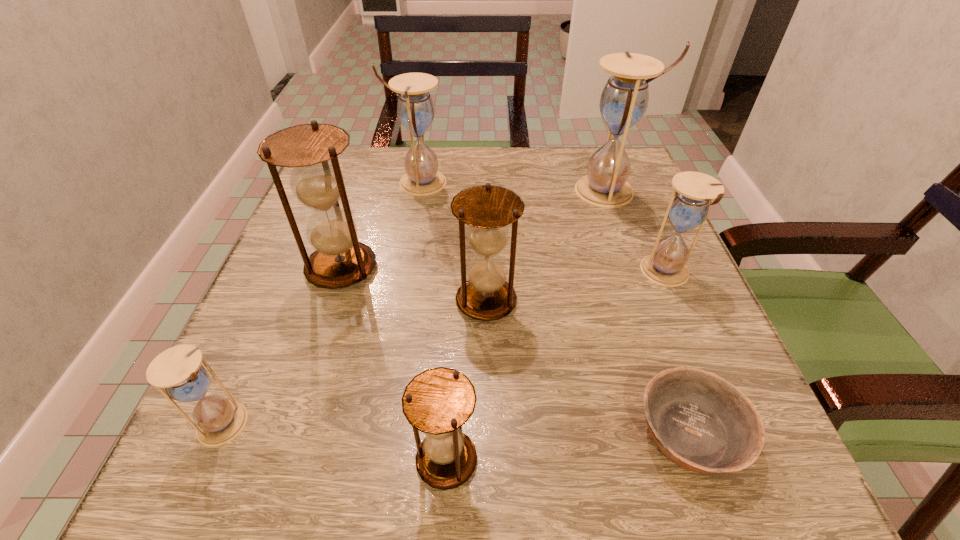
The width and height of the screenshot is (960, 540). Find the location of `object that is at the near left corner`. object that is at the near left corner is located at coordinates (178, 369).

You are a GUI agent. You are given a task and a screenshot of the screen. Output one action in this format:
    pyautogui.click(x=<x>, y=<y>)
    Task: Click on the object located at the far right corner
    This screenshot has height=540, width=960.
    Given the screenshot: What is the action you would take?
    pyautogui.click(x=624, y=100)

What are the coordinates of `object present at the near right corner` in the screenshot? It's located at (700, 421).

Identify the location of vacant space at the far edge of the desktop. (465, 157).

At what (x,y) coordinates should I click in order to perform the action: click on free spot at the near edge of the desktop. Please return your answer as a coordinate pair (x, y). This screenshot has height=540, width=960. Looking at the image, I should click on (589, 457).

The width and height of the screenshot is (960, 540). I want to click on vacant space at the left edge, so click(x=316, y=297).

Locate an element on the screen. The width and height of the screenshot is (960, 540). vacant space at the right edge of the desktop is located at coordinates (641, 315).

In the image, there is a desktop. At what (x,y) coordinates should I click in order to perform the action: click on free region at the far left corner. Please return your answer as a coordinate pair (x, y). Looking at the image, I should click on (375, 154).

The height and width of the screenshot is (540, 960). I want to click on free space between the tallest hourglass and the second white hourglass from left to right, so click(x=514, y=187).

The image size is (960, 540). In order to click on vacant space that's between the smallest white hourglass and the nearest brown hourglass in this screenshot , I will do `click(336, 442)`.